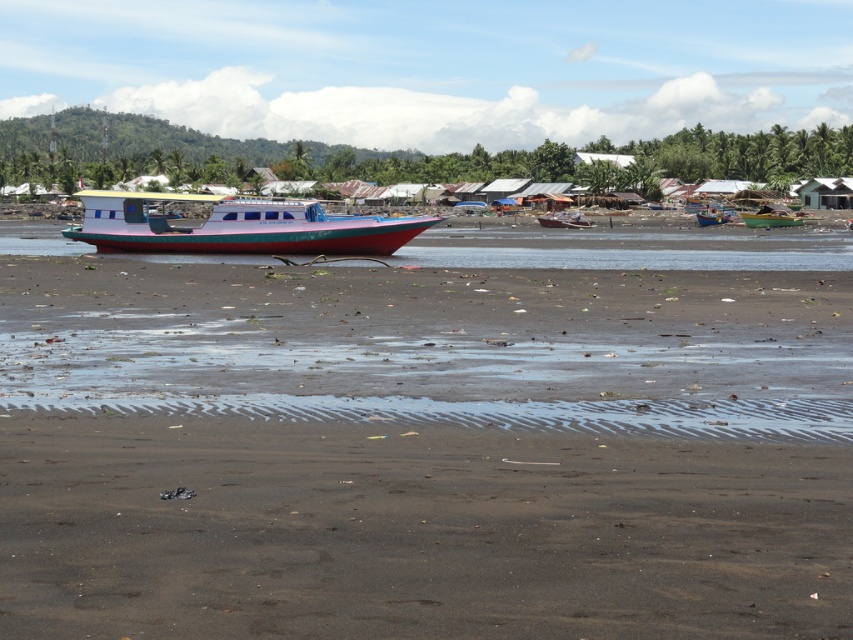
You are standing on the beach and want to walk to the metallic blue boat at center. Which direction should you head to avoid stepping on the dark sand at lower center?

To reach the metallic blue boat at center while avoiding the dark sand at lower center, you should walk towards the boat but stay above the dark sand at lower center since it is located below the boat.

You are standing on the beach and want to take a photo of the matte pink plastic boat at center. If you are facing north, which direction should you turn to find the boat?

The boat is located at coordinates (x=236, y=227), so you should turn east to face the boat.